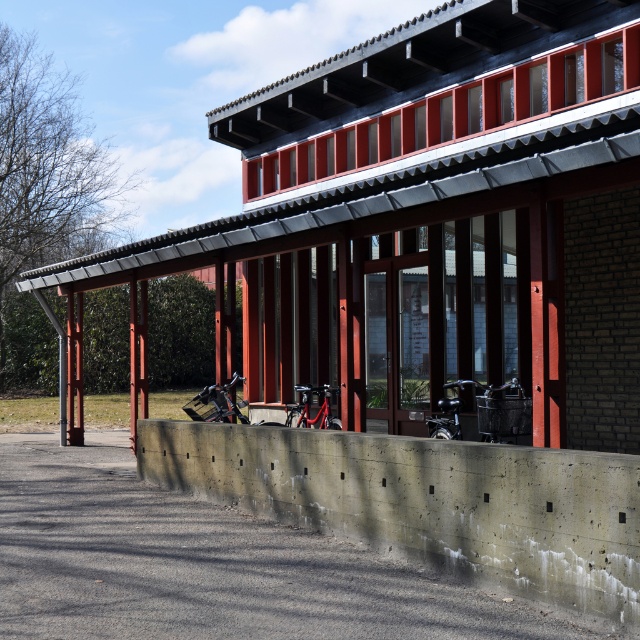
Based on the photo, you are a delivery person trying to park your 1.2 meter wide delivery van next to the metallic silver motorcycle at center. The concrete at lower center is the only available space. Can you fit your van there?

The concrete at lower center might be wider than the metallic silver motorcycle at center, but since the motorcycle is parked there, the space might be at least as wide as the motorcycle. However, without exact measurements, it is uncertain if the space is wide enough for your 1.2 meter delivery van.

You are standing at the entrance of the building and want to park your metallic silver motorcycle at center. According to the image, where exactly is the parking spot located?

The metallic silver motorcycle at center is parked at point coordinates of [216,403].